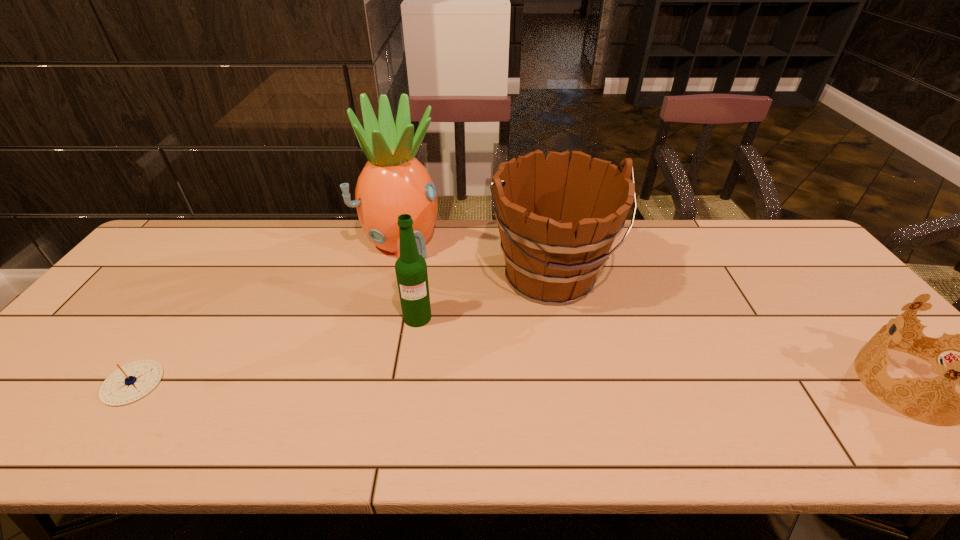
In order to click on vacant position located 0.210m with the handle on the wine bucket in this screenshot , I will do `click(613, 383)`.

Locate an element on the screen. vacant point located 0.230m with the handle on the wine bucket is located at coordinates (617, 390).

Identify the location of free spot located 0.100m on the label of the beer bottle. (423, 357).

The width and height of the screenshot is (960, 540). Identify the location of blank space located 0.150m on the label of the beer bottle. (426, 374).

You are a GUI agent. You are given a task and a screenshot of the screen. Output one action in this format:
    pyautogui.click(x=<x>, y=<y>)
    Task: Click on the vacant point located 0.170m on the label of the beer bottle
    
    Given the screenshot: What is the action you would take?
    point(427,380)

Identify the location of pineapple at the far edge. The height and width of the screenshot is (540, 960). coord(393,182).

The image size is (960, 540). What are the coordinates of `wine bucket positioned at the far edge` in the screenshot? It's located at (552, 258).

Find the location of a particular element. object at the near edge is located at coordinates (131, 382).

Where is `vacant space at the far edge of the desktop`? vacant space at the far edge of the desktop is located at coordinates (673, 252).

You are a GUI agent. You are given a task and a screenshot of the screen. Output one action in this format:
    pyautogui.click(x=<x>, y=<y>)
    Task: Click on the vacant space at the near edge of the desktop
    Image resolution: width=960 pixels, height=540 pixels.
    Given the screenshot: What is the action you would take?
    pyautogui.click(x=847, y=408)